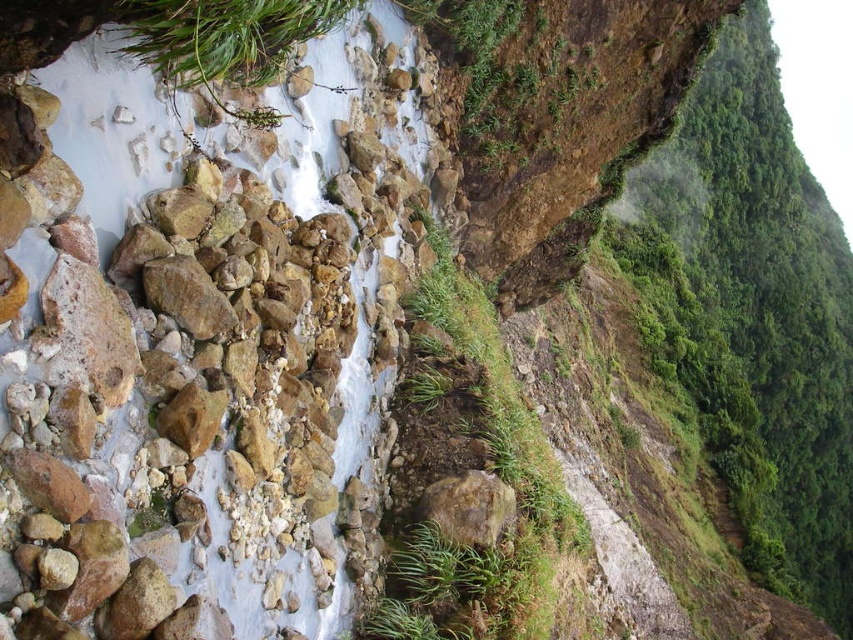
You are a hiker trying to navigate the slope. You need to step on the rusty metallic rock at center to proceed. Is the green leafy vegetation at upper right blocking your path to the rock?

The green leafy vegetation at upper right is above the rusty metallic rock at center, so it is not blocking the path to the rock. You can step on the rusty metallic rock at center without any obstruction from the vegetation.

You are a hiker trying to cross the rocky stream. You notice the green leafy vegetation at upper right and the rusty metallic rock at center. Which object could provide a wider surface to step on?

The green leafy vegetation at upper right might be wider than the rusty metallic rock at center, so it could provide a wider surface to step on.